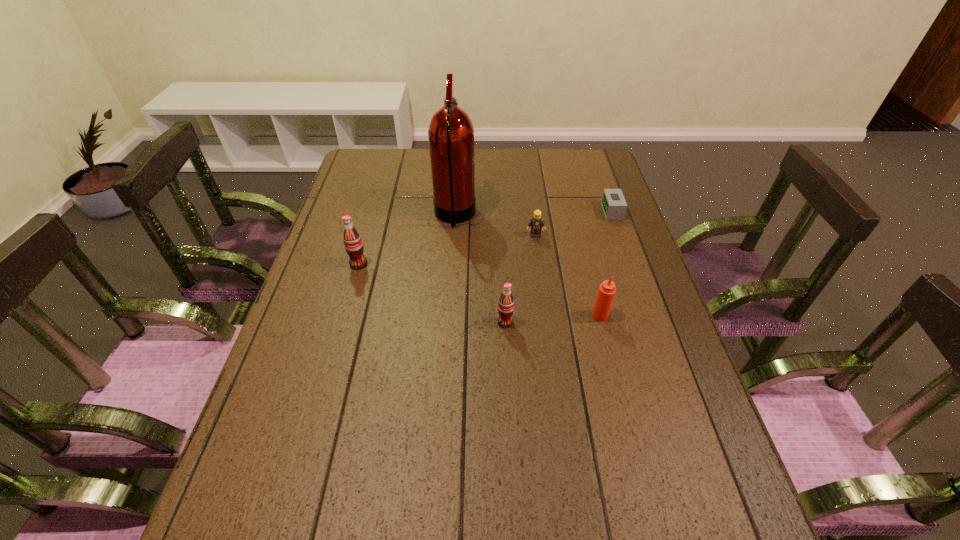
The height and width of the screenshot is (540, 960). Find the location of `free space that is in between the nearer soda and the leftmost object`. free space that is in between the nearer soda and the leftmost object is located at coordinates (432, 293).

Where is `empty location between the alarm clock and the third object from right to left`? This screenshot has height=540, width=960. empty location between the alarm clock and the third object from right to left is located at coordinates (573, 224).

The image size is (960, 540). In order to click on empty location between the third nearest object and the tallest object in this screenshot , I will do `click(407, 240)`.

The height and width of the screenshot is (540, 960). Find the location of `vacant space that is in between the rightmost object and the nearer soda`. vacant space that is in between the rightmost object and the nearer soda is located at coordinates (559, 267).

Where is `free space between the nearer soda and the rightmost object`? free space between the nearer soda and the rightmost object is located at coordinates (559, 267).

Find the location of `free spot between the fifth object from left to right and the shortest object`. free spot between the fifth object from left to right and the shortest object is located at coordinates (606, 264).

Where is `vacant area that lies between the Tabasco sauce and the fourth object from left to right`? This screenshot has height=540, width=960. vacant area that lies between the Tabasco sauce and the fourth object from left to right is located at coordinates (567, 275).

Where is `vacant space in between the fifth tallest object and the shortest object`? vacant space in between the fifth tallest object and the shortest object is located at coordinates (573, 224).

Where is `the third closest object to the fourth object from right to left`? The image size is (960, 540). the third closest object to the fourth object from right to left is located at coordinates (451, 133).

Select which object appears as the fourth closest to the rightmost object. Please provide its 2D coordinates. Your answer should be formatted as a tuple, i.e. [(x, y)], where the tuple contains the x and y coordinates of a point satisfying the conditions above.

[(506, 302)]